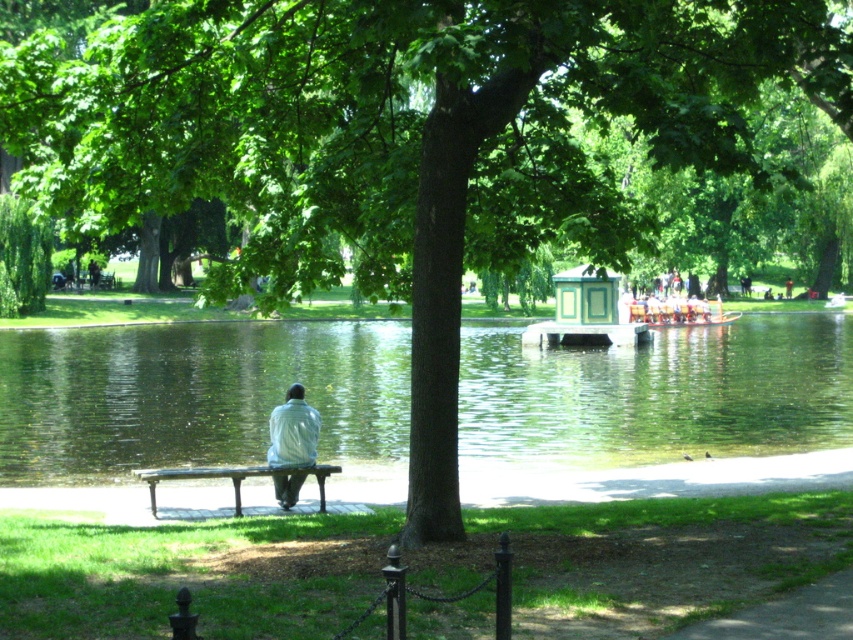
Which is below, green reflective water at center or wooden boat at center?

green reflective water at center is below.

Based on the photo, is green reflective water at center closer to camera compared to wooden boat at center?

Yes, it is in front of wooden boat at center.

What do you see at coordinates (195, 396) in the screenshot? The width and height of the screenshot is (853, 640). I see `green reflective water at center` at bounding box center [195, 396].

Find the location of a particular element. green reflective water at center is located at coordinates (195, 396).

Can you confirm if green reflective water at center is positioned above wooden bench at lower center?

Indeed, green reflective water at center is positioned over wooden bench at lower center.

Where is `green reflective water at center`? The width and height of the screenshot is (853, 640). green reflective water at center is located at coordinates (195, 396).

Is light blue fabric at center behind wooden bench at lower center?

Yes.

Can you confirm if light blue fabric at center is positioned below wooden bench at lower center?

Actually, light blue fabric at center is above wooden bench at lower center.

Who is more forward, (287, 438) or (173, 472)?

Point (173, 472) is more forward.

I want to click on light blue fabric at center, so click(292, 432).